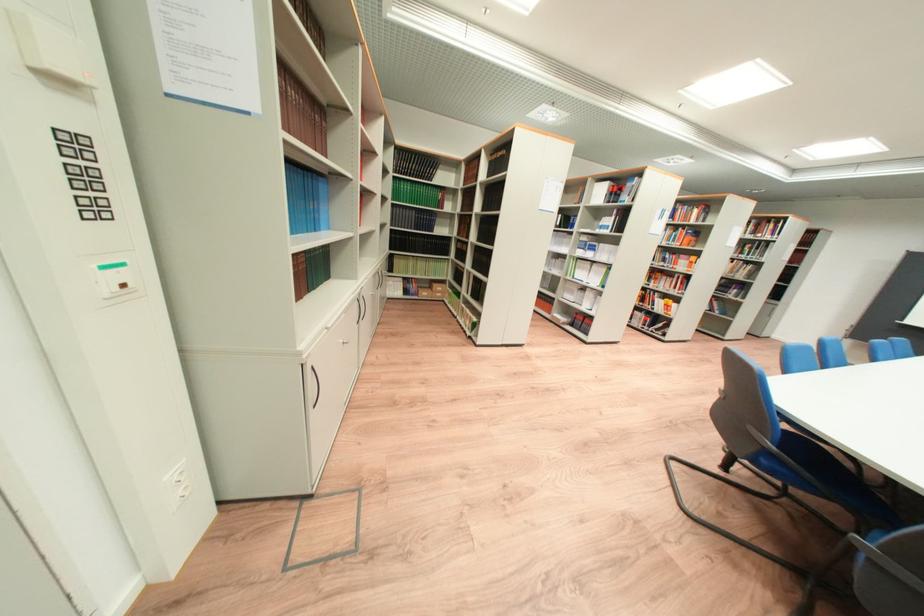
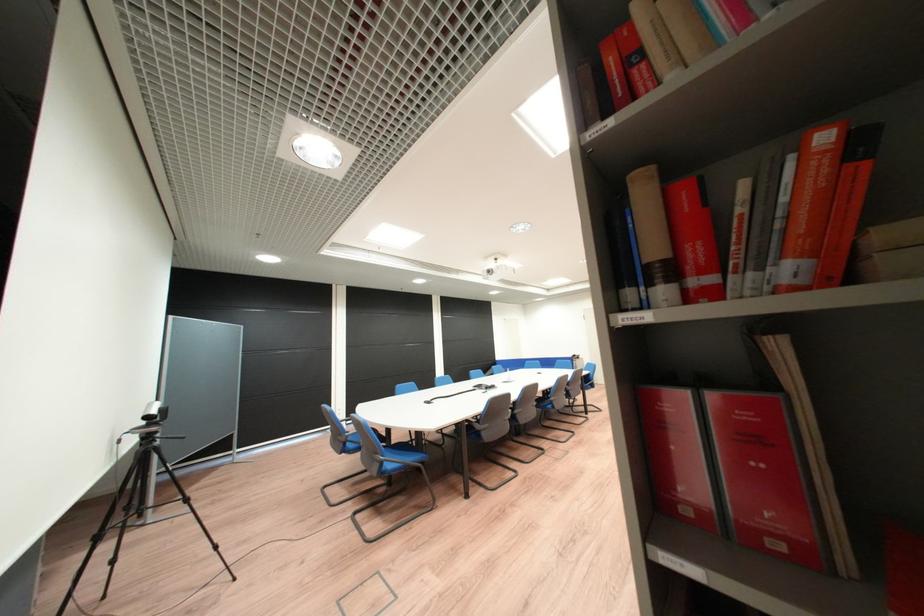
Question: I am providing you with two images of the same scene from different viewpoints. Which of the following objects are not visible in image2?

Choices:
 (A) red book
 (B) white electrical outlet
 (C) black coffee tamper
 (D) blue chair sitting surface

Answer: (B)